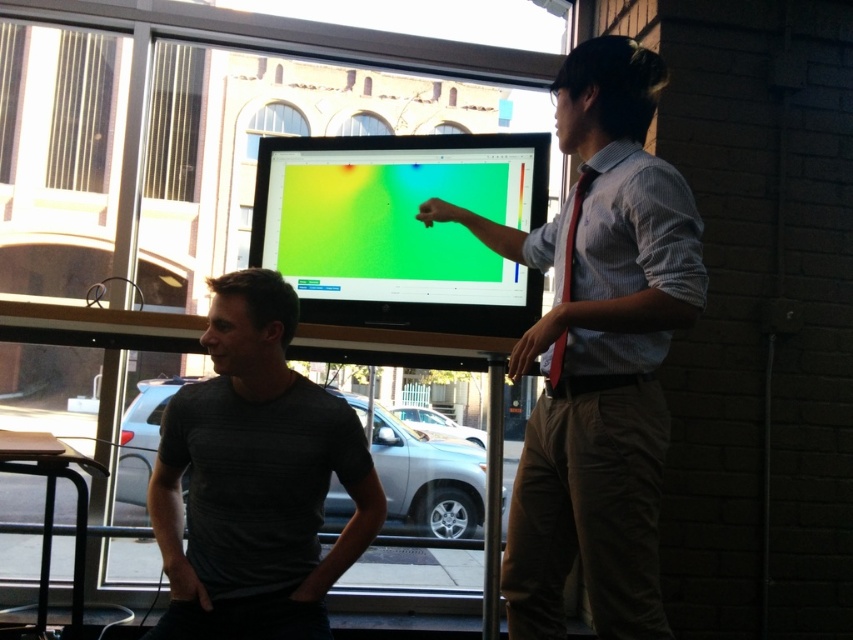
Can you confirm if gray textured shirt at center is thinner than matte plastic monitor at center?

Yes.

Between gray textured shirt at center and matte plastic monitor at center, which one is positioned lower?

Positioned lower is gray textured shirt at center.

Is point (376, 481) farther from camera compared to point (440, 308)?

No, (376, 481) is in front of (440, 308).

Locate an element on the screen. The image size is (853, 640). gray textured shirt at center is located at coordinates (254, 477).

Is light brown cotton shirt at center thinner than matte plastic monitor at center?

Yes, light brown cotton shirt at center is thinner than matte plastic monitor at center.

Which is more to the left, light brown cotton shirt at center or matte plastic monitor at center?

Positioned to the left is matte plastic monitor at center.

Locate an element on the screen. light brown cotton shirt at center is located at coordinates (596, 353).

Is light brown cotton shirt at center smaller than gray textured shirt at center?

No, light brown cotton shirt at center is not smaller than gray textured shirt at center.

Between light brown cotton shirt at center and gray textured shirt at center, which one is positioned lower?

Positioned lower is gray textured shirt at center.

The width and height of the screenshot is (853, 640). What are the coordinates of `light brown cotton shirt at center` in the screenshot? It's located at (596, 353).

Locate an element on the screen. light brown cotton shirt at center is located at coordinates (596, 353).